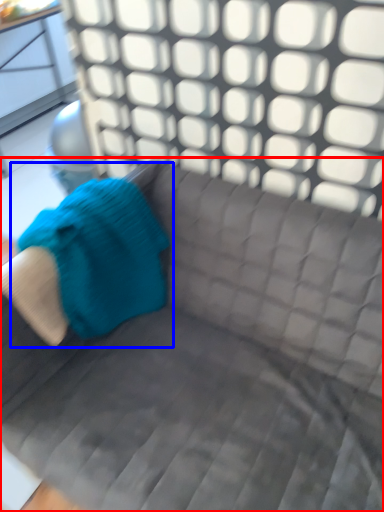
Question: Which of the following is the closest to the observer, studio couch (highlighted by a red box) or bean bag chair (highlighted by a blue box)?

Choices:
 (A) studio couch
 (B) bean bag chair

Answer: (A)